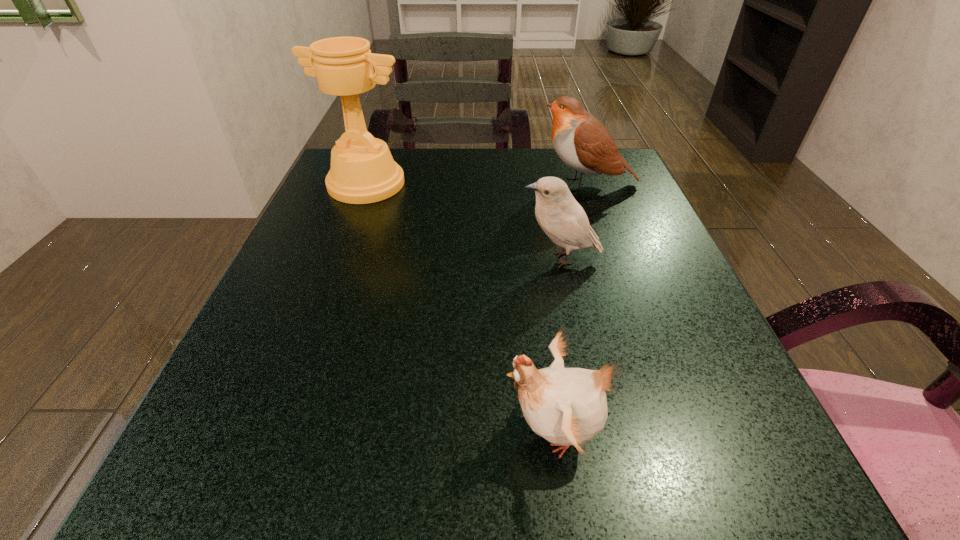
At what (x,y) coordinates should I click in order to perform the action: click on object that is at the far right corner. Please return your answer as a coordinate pair (x, y). This screenshot has height=540, width=960. Looking at the image, I should click on click(583, 143).

Identify the location of vacant space at the far edge of the desktop. Image resolution: width=960 pixels, height=540 pixels. point(534,167).

In the image, there is a desktop. Find the location of `vacant space at the near edge`. vacant space at the near edge is located at coordinates (512, 469).

The width and height of the screenshot is (960, 540). In the image, there is a desktop. Find the location of `vacant area at the left edge`. vacant area at the left edge is located at coordinates (x=368, y=243).

What are the coordinates of `vacant space at the right edge of the desktop` in the screenshot? It's located at coord(657,414).

I want to click on free space at the far right corner of the desktop, so click(x=636, y=197).

At what (x,y) coordinates should I click in order to perform the action: click on vacant space at the near right corner. Please return your answer as a coordinate pair (x, y). Looking at the image, I should click on pyautogui.click(x=808, y=515).

This screenshot has width=960, height=540. I want to click on free space between the farthest bird and the tallest object, so click(x=476, y=184).

The height and width of the screenshot is (540, 960). I want to click on blank region between the nearest object and the award, so click(460, 307).

This screenshot has height=540, width=960. In order to click on free point between the second farthest bird and the tallest object in this screenshot , I will do `click(464, 221)`.